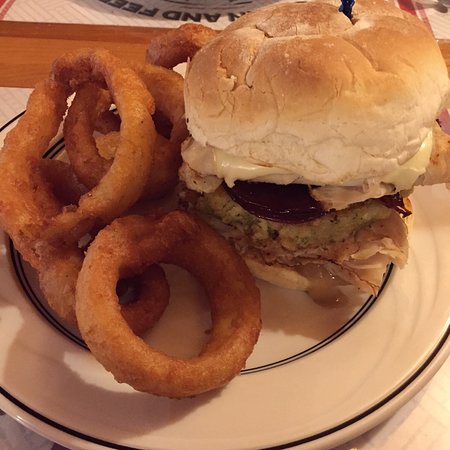
Find the location of a particular element. This screenshot has width=450, height=450. plate is located at coordinates (391, 376).